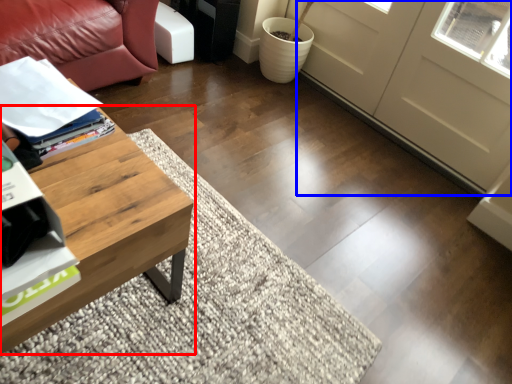
Question: Which point is closer to the camera, coffee table (highlighted by a red box) or screen door (highlighted by a blue box)?

Choices:
 (A) coffee table
 (B) screen door

Answer: (A)